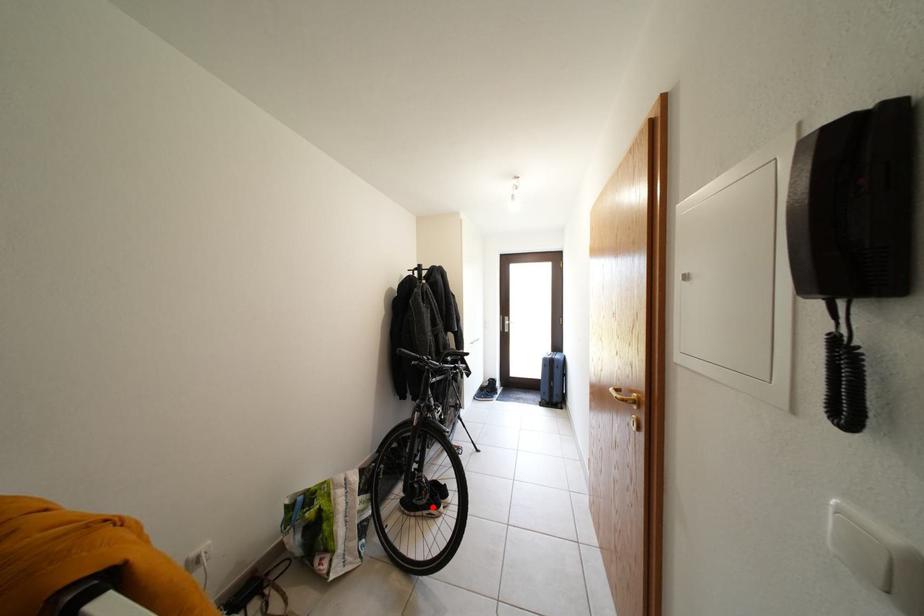
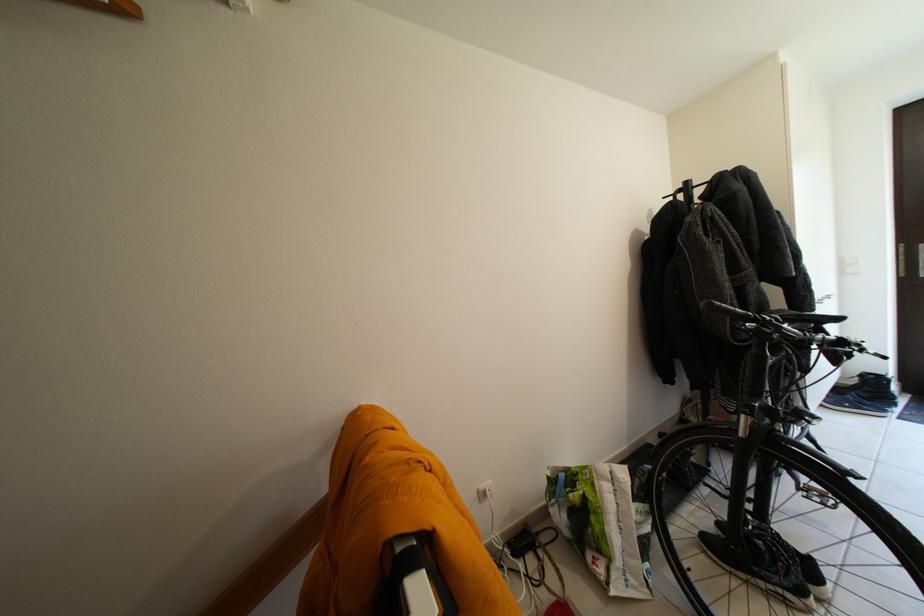
In the second image, find the point that corresponds to the highlighted location in the first image.

(794, 588)